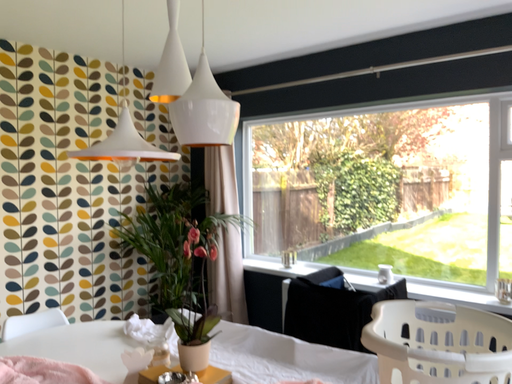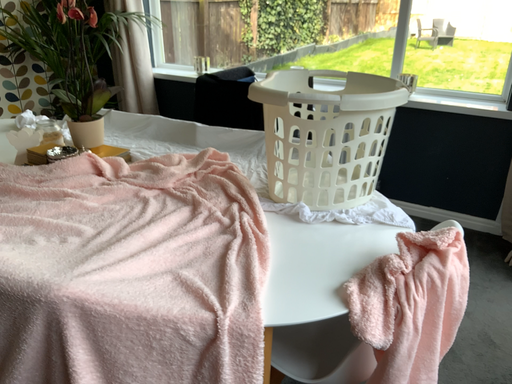
Question: How did the camera likely rotate when shooting the video?

Choices:
 (A) rotated upward
 (B) rotated downward

Answer: (B)